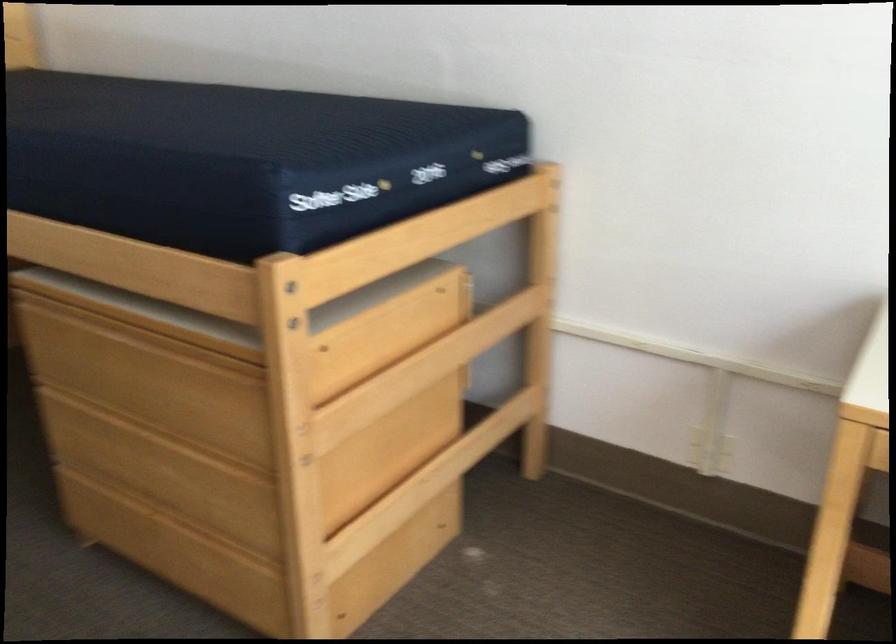
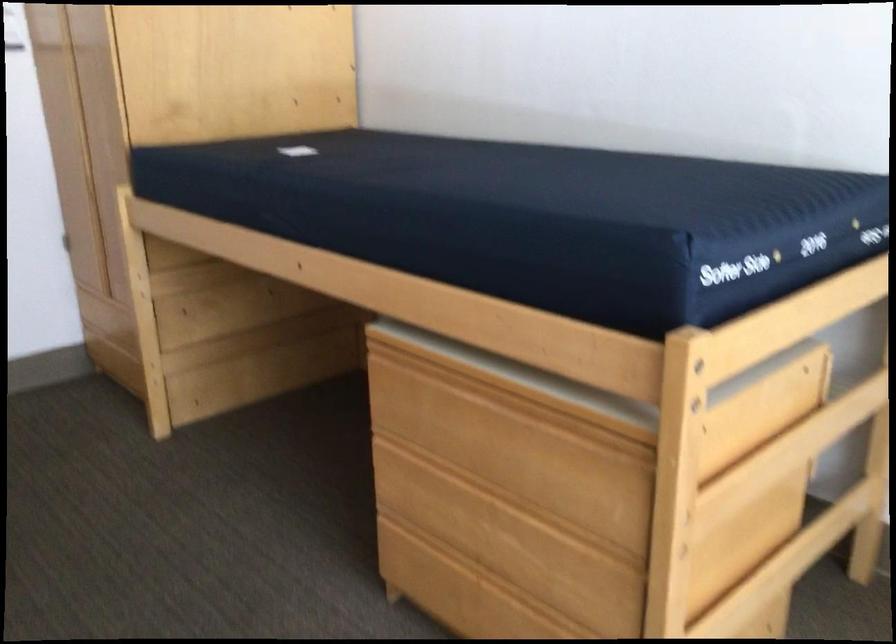
Find the pixel in the second image that matches point (157, 321) in the first image.

(520, 383)